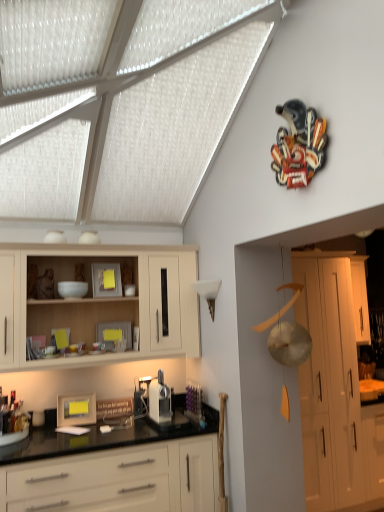
Question: In terms of height, does white glossy cabinets at lower center, marked as the third cabinetry in a right-to-left arrangement, look taller or shorter compared to white glossy cabinet at right, positioned as the 4th cabinetry in left-to-right order?

Choices:
 (A) short
 (B) tall

Answer: (B)

Question: From a real-world perspective, relative to white glossy cabinet at right, positioned as the 4th cabinetry in left-to-right order, is white glossy cabinets at lower center, marked as the third cabinetry in a right-to-left arrangement, vertically above or below?

Choices:
 (A) below
 (B) above

Answer: (A)

Question: Estimate the real-world distances between objects in this image. Which object is farther from the white matte cabinet at right, which is the second cabinetry from right to left?

Choices:
 (A) white glossy cabinet at right, which is the 1th cabinetry in right-to-left order
 (B) white glossy cabinets at lower center, marked as the third cabinetry in a right-to-left arrangement
 (C) light wood cabinet at upper left, acting as the 4th cabinetry starting from the right
 (D) matte wooden picture frame at lower left

Answer: (D)

Question: Estimate the real-world distances between objects in this image. Which object is farther from the white glossy cabinets at lower center, marked as the third cabinetry in a right-to-left arrangement?

Choices:
 (A) white glossy cabinet at right, positioned as the 4th cabinetry in left-to-right order
 (B) matte wooden picture frame at lower left
 (C) light wood cabinet at upper left, which appears as the 1th cabinetry when viewed from the left
 (D) white matte cabinet at right, the third cabinetry viewed from the left

Answer: (A)